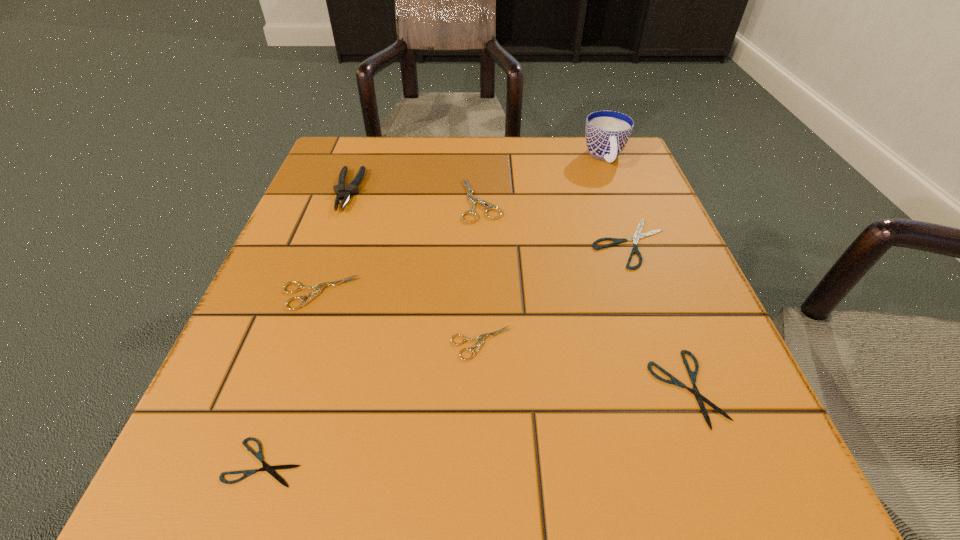
Where is `the second biggest black shears`? This screenshot has width=960, height=540. the second biggest black shears is located at coordinates (692, 375).

Identify the location of the nearest object. This screenshot has width=960, height=540. (270, 469).

Find the location of a particular element. This screenshot has width=960, height=540. the nearest shears is located at coordinates (270, 469).

Where is `blank area located 0.400m on the side of the blue cup with the handle`? Image resolution: width=960 pixels, height=540 pixels. blank area located 0.400m on the side of the blue cup with the handle is located at coordinates (664, 313).

Locate an element on the screen. vacant space located 0.400m at the gripping part of the second tallest object is located at coordinates (271, 398).

Where is `vacant space located 0.270m on the front of the sixth shortest object`? The image size is (960, 540). vacant space located 0.270m on the front of the sixth shortest object is located at coordinates click(x=481, y=338).

Find the location of a particular element. free space located on the right of the second smallest beige shears is located at coordinates (424, 293).

Locate an element on the screen. This screenshot has width=960, height=540. vacant area situated on the back of the farthest black shears is located at coordinates (595, 147).

Image resolution: width=960 pixels, height=540 pixels. Find the location of `vacant region located 0.140m on the back of the smallest beige shears`. vacant region located 0.140m on the back of the smallest beige shears is located at coordinates (481, 263).

Where is `free location located 0.060m on the front of the second nearest black shears`? This screenshot has height=540, width=960. free location located 0.060m on the front of the second nearest black shears is located at coordinates (721, 481).